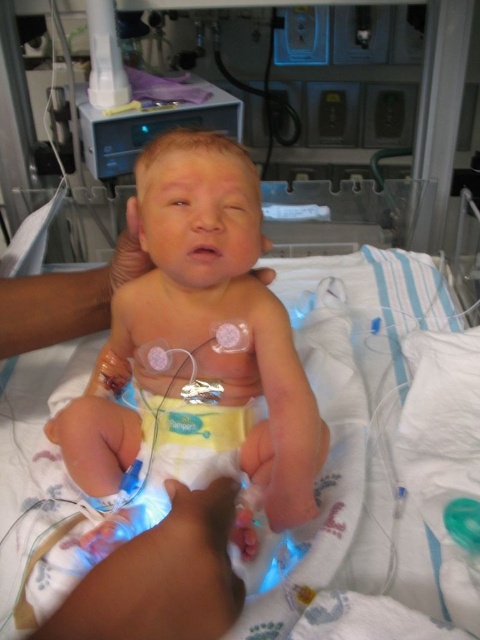
Who is lower down, smooth skin newborn at center or white soft hand at lower center?

white soft hand at lower center is lower down.

What do you see at coordinates (200, 330) in the screenshot? I see `smooth skin newborn at center` at bounding box center [200, 330].

Locate an element on the screen. smooth skin newborn at center is located at coordinates (200, 330).

Measure the distance between smooth skin newborn at center and white soft hospital bed at center.

The distance of smooth skin newborn at center from white soft hospital bed at center is 10.47 inches.

Which is in front, point (166, 214) or point (40, 404)?

Point (166, 214)

At what (x,y) coordinates should I click in order to perform the action: click on smooth skin newborn at center. Please return your answer as a coordinate pair (x, y). Image resolution: width=480 pixels, height=640 pixels. Looking at the image, I should click on (200, 330).

In the scene shown: Is white soft hospital bed at center positioned before white soft hand at lower center?

No.

Is white soft hospital bed at center thinner than white soft hand at lower center?

In fact, white soft hospital bed at center might be wider than white soft hand at lower center.

Who is more forward, (330, 368) or (85, 604)?

Point (85, 604) is more forward.

In order to click on white soft hospital bed at center in this screenshot , I will do `click(363, 433)`.